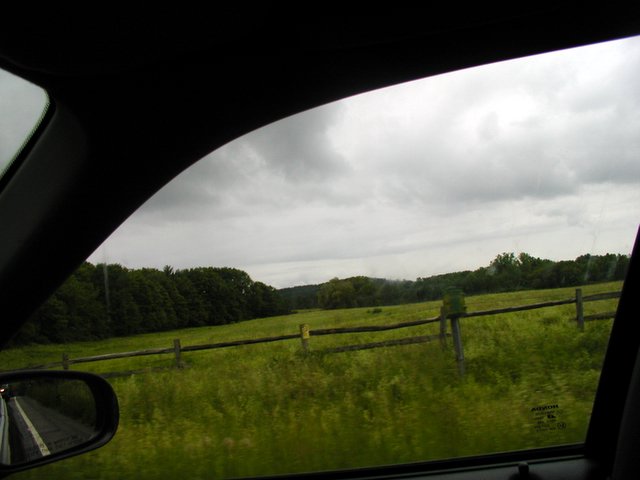
This screenshot has height=480, width=640. I want to click on mirror, so click(x=44, y=432).